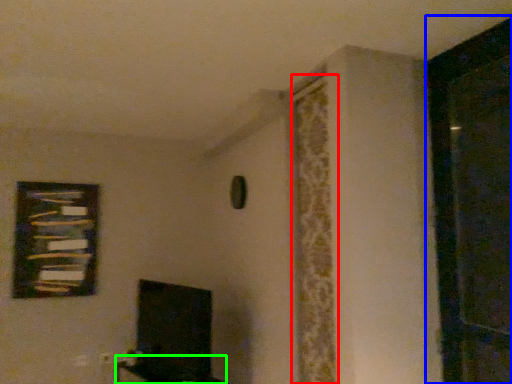
Question: Estimate the real-world distances between objects in this image. Which object is closer to curtain (highlighted by a red box), screen door (highlighted by a blue box) or furniture (highlighted by a green box)?

Choices:
 (A) screen door
 (B) furniture

Answer: (A)